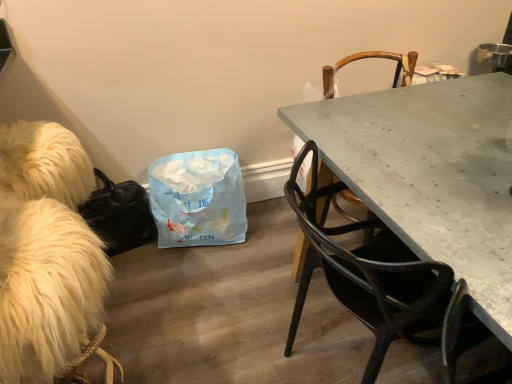
Question: Is metallic gray chair at right, which appears as the 1th chair when viewed from the back, at the back of matte black chair at right, the 1th chair viewed from the front?

Choices:
 (A) yes
 (B) no

Answer: (B)

Question: Does matte black chair at right, the 1th chair viewed from the front, turn towards metallic gray chair at right, which appears as the 1th chair when viewed from the back?

Choices:
 (A) yes
 (B) no

Answer: (B)

Question: Would you say matte black chair at right, which is counted as the 2th chair, starting from the back, contains metallic gray chair at right, the second chair when ordered from front to back?

Choices:
 (A) yes
 (B) no

Answer: (B)

Question: Can you confirm if matte black chair at right, which is counted as the 2th chair, starting from the back, is smaller than metallic gray chair at right, which appears as the 1th chair when viewed from the back?

Choices:
 (A) no
 (B) yes

Answer: (A)

Question: Can you confirm if matte black chair at right, the 1th chair viewed from the front, is wider than metallic gray chair at right, the second chair when ordered from front to back?

Choices:
 (A) no
 (B) yes

Answer: (B)

Question: Is matte black chair at right, the 1th chair viewed from the front, not near metallic gray chair at right, which appears as the 1th chair when viewed from the back?

Choices:
 (A) no
 (B) yes

Answer: (A)

Question: Is light blue paper bag at center taller than white fluffy dog at left?

Choices:
 (A) yes
 (B) no

Answer: (B)

Question: Is light blue paper bag at center bigger than white fluffy dog at left?

Choices:
 (A) yes
 (B) no

Answer: (B)

Question: Considering the relative positions of light blue paper bag at center and white fluffy dog at left in the image provided, is light blue paper bag at center in front of white fluffy dog at left?

Choices:
 (A) yes
 (B) no

Answer: (B)

Question: From the image's perspective, is light blue paper bag at center located beneath white fluffy dog at left?

Choices:
 (A) no
 (B) yes

Answer: (A)

Question: Is light blue paper bag at center to the right of white fluffy dog at left from the viewer's perspective?

Choices:
 (A) no
 (B) yes

Answer: (B)

Question: Can white fluffy dog at left be found inside light blue paper bag at center?

Choices:
 (A) no
 (B) yes

Answer: (A)

Question: Is white fluffy dog at left further to the viewer compared to metallic gray chair at right, which appears as the 1th chair when viewed from the back?

Choices:
 (A) no
 (B) yes

Answer: (A)